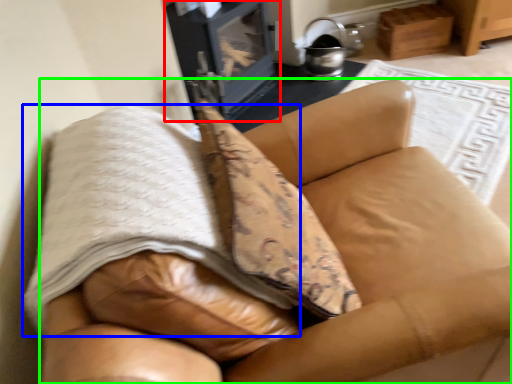
Question: Which is farther away from stove (highlighted by a red box)? blanket (highlighted by a blue box) or furniture (highlighted by a green box)?

Choices:
 (A) blanket
 (B) furniture

Answer: (A)